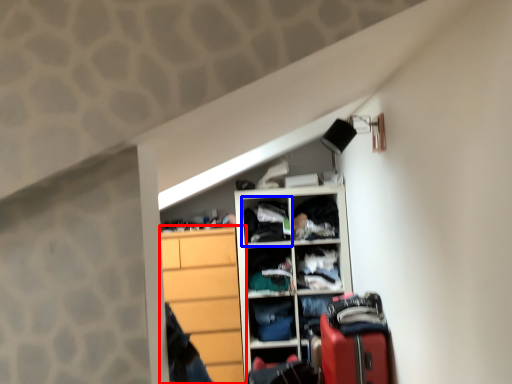
Question: Which object appears farthest to the camera in this image, cabinetry (highlighted by a red box) or cabinet (highlighted by a blue box)?

Choices:
 (A) cabinetry
 (B) cabinet

Answer: (B)